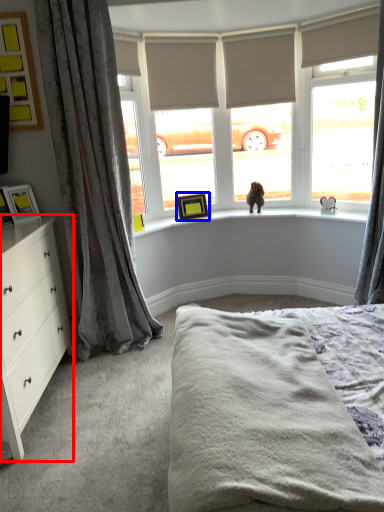
Question: Which object is closer to the camera taking this photo, chest of drawers (highlighted by a red box) or picture frame (highlighted by a blue box)?

Choices:
 (A) chest of drawers
 (B) picture frame

Answer: (A)